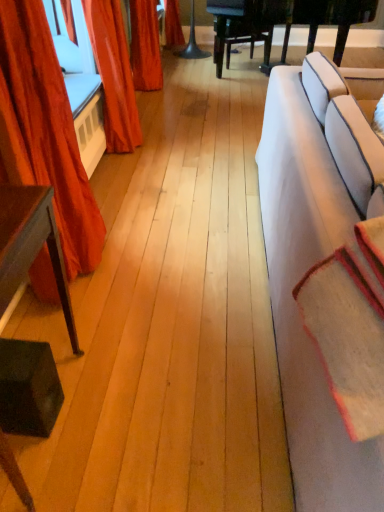
The width and height of the screenshot is (384, 512). Identify the location of vacant area that lies to the right of dark brown wood table at left. (133, 411).